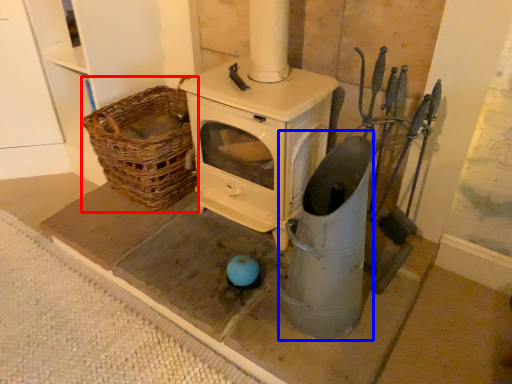
Question: Which point is closer to the camera, basket (highlighted by a red box) or appliance (highlighted by a blue box)?

Choices:
 (A) basket
 (B) appliance

Answer: (B)